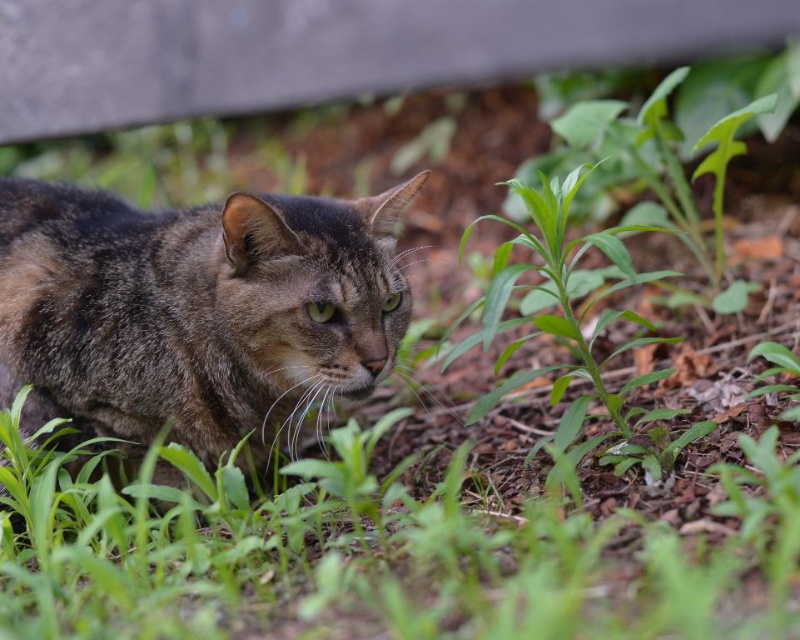
Between tabby fur cat at center and green leafy plant at center, which one is positioned higher?

green leafy plant at center is higher up.

Find the location of `tabby fur cat at center`. tabby fur cat at center is located at coordinates click(196, 310).